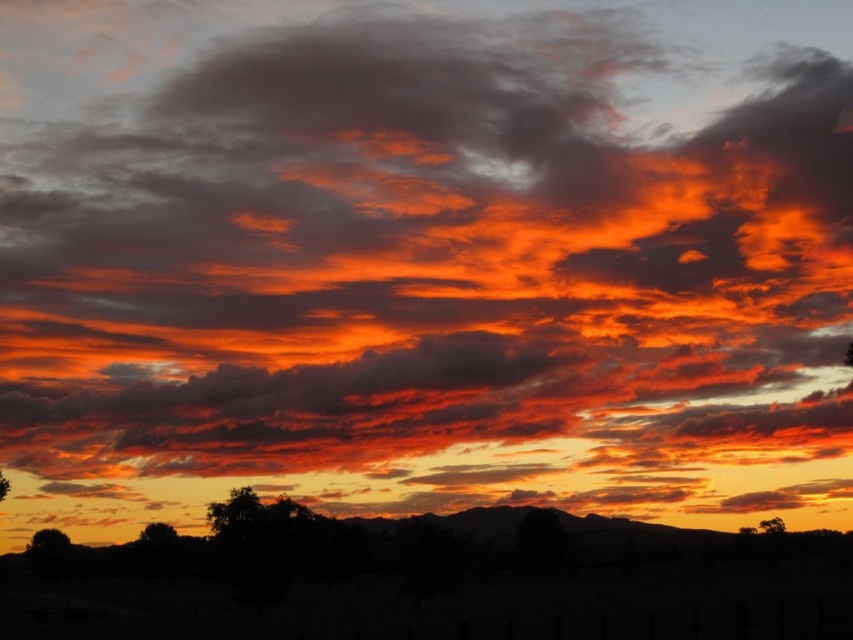
Between point (209, 506) and point (766, 531), which one is positioned in front?

Point (209, 506) is in front.

Who is positioned more to the left, silhouetted tree at center or green leafy tree at lower right?

silhouetted tree at center is more to the left.

Is point (227, 508) farther from camera compared to point (770, 531)?

No, (227, 508) is in front of (770, 531).

The image size is (853, 640). In order to click on silhouetted tree at center in this screenshot , I will do `click(233, 513)`.

Can you confirm if green matte tree at lower left is taller than green leafy tree at lower left?

Yes.

Does point (160, 536) come behind point (4, 499)?

That is True.

Is point (152, 524) farther from viewer compared to point (0, 493)?

Yes, it is behind point (0, 493).

Image resolution: width=853 pixels, height=640 pixels. In order to click on green matte tree at lower left in this screenshot , I will do [157, 536].

Does silhouette tree at lower left have a lesser height compared to green matte tree at lower left?

Yes.

Does silhouette tree at lower left appear over green matte tree at lower left?

Yes, silhouette tree at lower left is above green matte tree at lower left.

Which is behind, point (49, 550) or point (138, 541)?

The point (138, 541) is behind.

Find the location of a particular element. The width and height of the screenshot is (853, 640). silhouette tree at lower left is located at coordinates (47, 541).